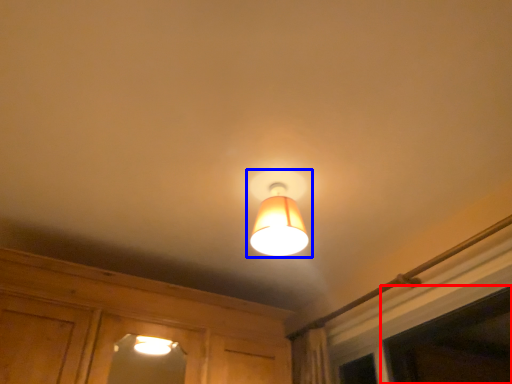
Question: Which of the following is the farthest to the observer, window (highlighted by a red box) or lamp (highlighted by a blue box)?

Choices:
 (A) window
 (B) lamp

Answer: (B)